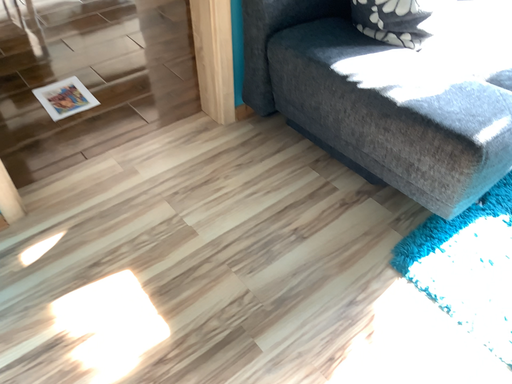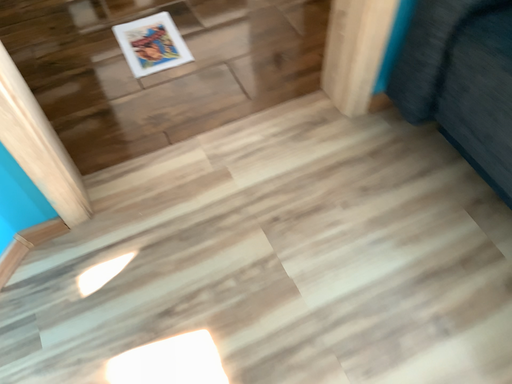
Question: How did the camera likely rotate when shooting the video?

Choices:
 (A) rotated upward
 (B) rotated downward

Answer: (B)